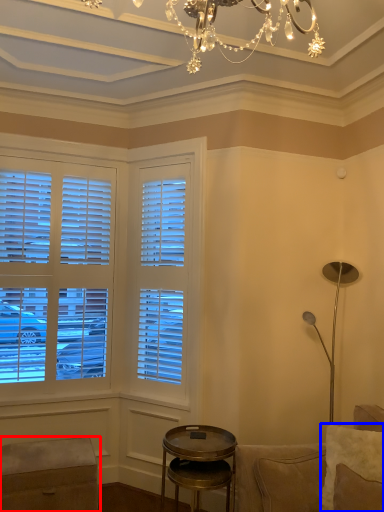
Question: Which of the following is the farthest to the observer, music stool (highlighted by a red box) or pillow (highlighted by a blue box)?

Choices:
 (A) music stool
 (B) pillow

Answer: (A)